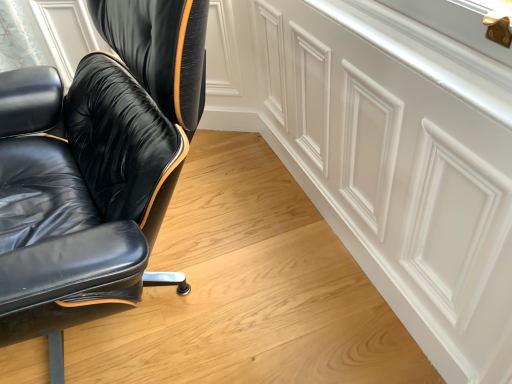
Identify the location of white matte cabinetry at upper right. The image size is (512, 384). (401, 165).

What is the approximate width of white matte cabinetry at upper right?

The width of white matte cabinetry at upper right is 2.25 inches.

This screenshot has height=384, width=512. What do you see at coordinates (401, 165) in the screenshot? I see `white matte cabinetry at upper right` at bounding box center [401, 165].

The image size is (512, 384). In order to click on black leather chair at left in this screenshot , I will do `click(95, 169)`.

What do you see at coordinates (95, 169) in the screenshot? I see `black leather chair at left` at bounding box center [95, 169].

Image resolution: width=512 pixels, height=384 pixels. I want to click on white matte cabinetry at upper right, so click(401, 165).

Considering the positions of objects black leather chair at left and white matte cabinetry at upper right in the image provided, who is more to the left, black leather chair at left or white matte cabinetry at upper right?

From the viewer's perspective, black leather chair at left appears more on the left side.

Is the depth of black leather chair at left less than that of white matte cabinetry at upper right?

Yes, it is.

Does point (103, 127) come behind point (421, 283)?

Yes.

Consider the image. From the image's perspective, is black leather chair at left above or below white matte cabinetry at upper right?

black leather chair at left is above white matte cabinetry at upper right.

From a real-world perspective, does black leather chair at left stand above white matte cabinetry at upper right?

Yes.

Considering the relative sizes of black leather chair at left and white matte cabinetry at upper right in the image provided, is black leather chair at left wider than white matte cabinetry at upper right?

Yes.

Between black leather chair at left and white matte cabinetry at upper right, which one has more height?

Standing taller between the two is black leather chair at left.

Is black leather chair at left bigger than white matte cabinetry at upper right?

Yes.

Could white matte cabinetry at upper right be considered to be inside black leather chair at left?

No, white matte cabinetry at upper right is located outside of black leather chair at left.

In the scene shown: Are black leather chair at left and white matte cabinetry at upper right beside each other?

No, black leather chair at left is not beside white matte cabinetry at upper right.

Is black leather chair at left facing away from white matte cabinetry at upper right?

That's right, black leather chair at left is facing away from white matte cabinetry at upper right.

How distant is black leather chair at left from white matte cabinetry at upper right?

black leather chair at left and white matte cabinetry at upper right are 20.85 inches apart from each other.

Identify the location of cabinetry below the black leather chair at left (from a real-world perspective). This screenshot has width=512, height=384. [401, 165].

Would you say white matte cabinetry at upper right is to the left or to the right of black leather chair at left in the picture?

From the image, it's evident that white matte cabinetry at upper right is to the right of black leather chair at left.

Is white matte cabinetry at upper right further to the viewer compared to black leather chair at left?

Yes, white matte cabinetry at upper right is behind black leather chair at left.

Does point (467, 248) come in front of point (149, 245)?

No, (467, 248) is behind (149, 245).

From the image's perspective, which is above, white matte cabinetry at upper right or black leather chair at left?

black leather chair at left is shown above in the image.

From a real-world perspective, is white matte cabinetry at upper right physically above black leather chair at left?

No, from a real-world perspective, white matte cabinetry at upper right is not on top of black leather chair at left.

In terms of width, does white matte cabinetry at upper right look wider or thinner when compared to black leather chair at left?

In the image, white matte cabinetry at upper right appears to be more narrow than black leather chair at left.

Considering the sizes of objects white matte cabinetry at upper right and black leather chair at left in the image provided, who is taller, white matte cabinetry at upper right or black leather chair at left?

Standing taller between the two is black leather chair at left.

From the picture: In terms of size, does white matte cabinetry at upper right appear bigger or smaller than black leather chair at left?

In the image, white matte cabinetry at upper right appears to be smaller than black leather chair at left.

Is white matte cabinetry at upper right not inside black leather chair at left?

Yes, white matte cabinetry at upper right is outside of black leather chair at left.

Is white matte cabinetry at upper right far away from black leather chair at left?

They are positioned close to each other.

Is white matte cabinetry at upper right looking in the opposite direction of black leather chair at left?

white matte cabinetry at upper right does not have its back to black leather chair at left.

How different are the orientations of white matte cabinetry at upper right and black leather chair at left in degrees?

There is a 6.67-degree angle between the facing directions of white matte cabinetry at upper right and black leather chair at left.

Measure the distance from white matte cabinetry at upper right to black leather chair at left.

white matte cabinetry at upper right is 52.96 centimeters away from black leather chair at left.

Locate an element on the screen. The image size is (512, 384). chair located on the left of white matte cabinetry at upper right is located at coordinates (95, 169).

Find the location of `cabinetry below the black leather chair at left (from the image's perspective)`. cabinetry below the black leather chair at left (from the image's perspective) is located at coordinates (401, 165).

You are a GUI agent. You are given a task and a screenshot of the screen. Output one action in this format:
    pyautogui.click(x=<x>, y=<y>)
    Task: Click on the chair that is above the white matte cabinetry at upper right (from the image's perspective)
    The image size is (512, 384).
    Given the screenshot: What is the action you would take?
    pyautogui.click(x=95, y=169)